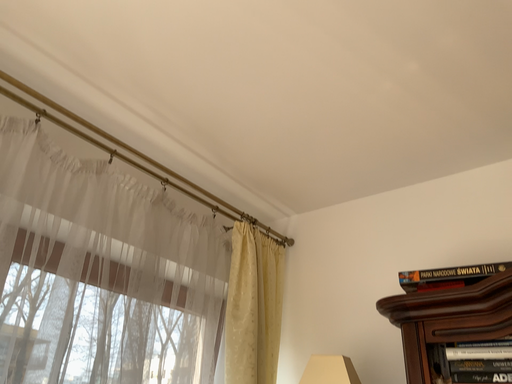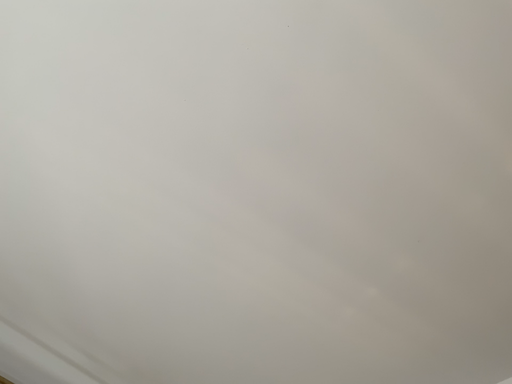
Question: Which way did the camera rotate in the video?

Choices:
 (A) rotated upward
 (B) rotated downward

Answer: (A)